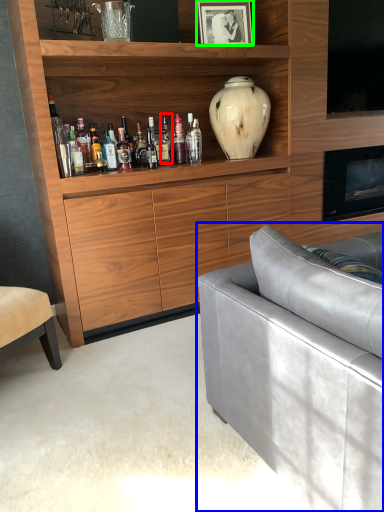
Question: Based on their relative distances, which object is nearer to bottle (highlighted by a red box)? Choose from studio couch (highlighted by a blue box) and picture frame (highlighted by a green box).

Choices:
 (A) studio couch
 (B) picture frame

Answer: (B)